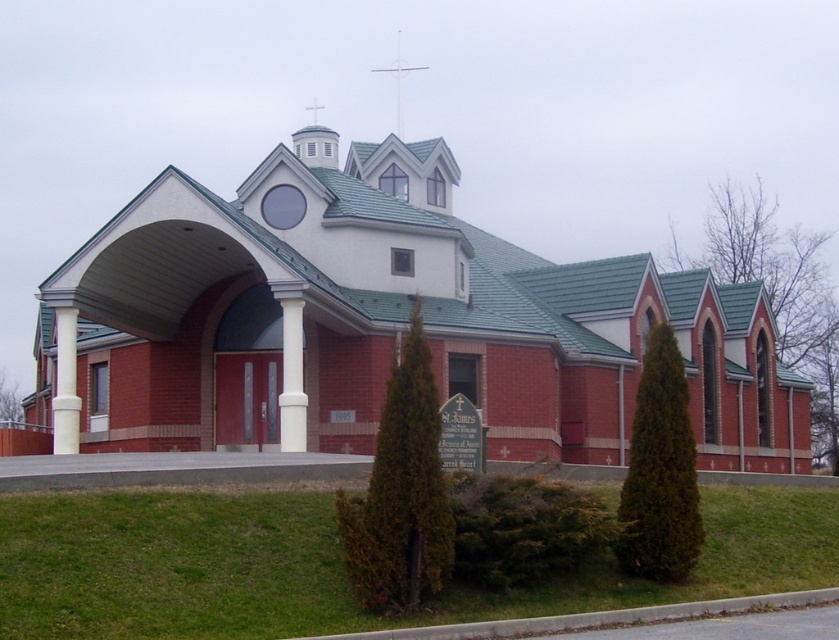
Is red brick chapel at center above white smooth column at left?

Correct, red brick chapel at center is located above white smooth column at left.

Does red brick chapel at center come in front of white smooth column at left?

Yes, it is.

This screenshot has width=839, height=640. Describe the element at coordinates (389, 321) in the screenshot. I see `red brick chapel at center` at that location.

At what (x,y) coordinates should I click in order to perform the action: click on red brick chapel at center. Please return your answer as a coordinate pair (x, y). The image size is (839, 640). Looking at the image, I should click on (389, 321).

Between point (694, 342) and point (287, 378), which one is positioned behind?

The point (694, 342) is more distant.

Between red brick chapel at center and white smooth column at center, which one is positioned higher?

Positioned higher is red brick chapel at center.

Who is more forward, [477,292] or [289,374]?

Point [289,374]

This screenshot has width=839, height=640. What are the coordinates of `red brick chapel at center` in the screenshot? It's located at (x=389, y=321).

Is point (60, 452) closer to camera compared to point (395, 81)?

Yes, it is in front of point (395, 81).

Between white smooth column at left and white metal cross at upper center, which one has less height?

white smooth column at left

Between point (73, 417) and point (409, 68), which one is positioned in front?

Point (73, 417) is in front.

In order to click on white smooth column at left in this screenshot , I will do `click(65, 385)`.